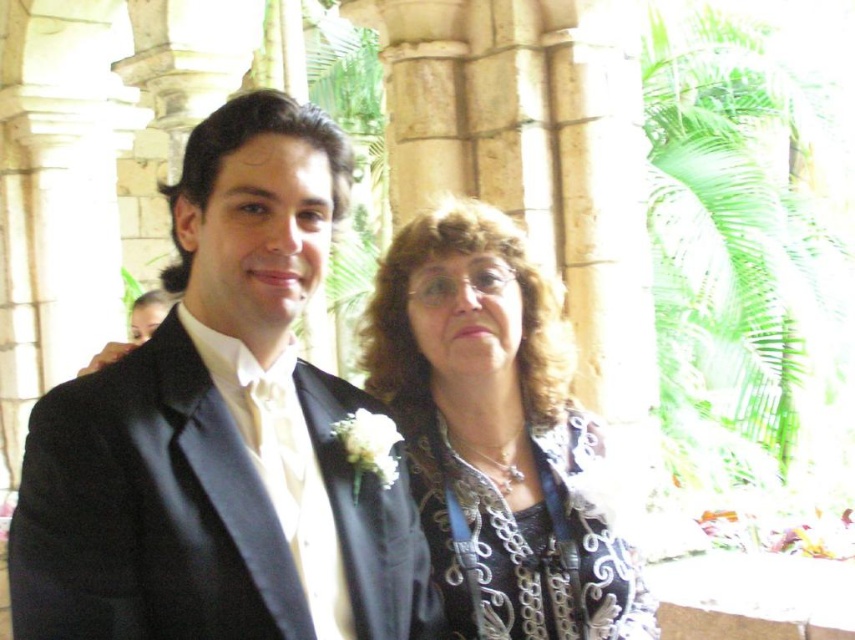
Question: Which object is the farthest from the satin black suit at center?

Choices:
 (A) silver embroidered jacket at center
 (B) silver metallic dress at center

Answer: (B)

Question: Which of the following is the closest to the observer?

Choices:
 (A) (516, 333)
 (B) (422, 476)

Answer: (B)

Question: Can you confirm if satin black suit at center is thinner than silver metallic dress at center?

Choices:
 (A) yes
 (B) no

Answer: (B)

Question: Which object is positioned closest to the silver metallic dress at center?

Choices:
 (A) satin black suit at center
 (B) silver embroidered jacket at center

Answer: (B)

Question: Is the position of silver embroidered jacket at center more distant than that of silver metallic dress at center?

Choices:
 (A) yes
 (B) no

Answer: (B)

Question: Can you confirm if silver embroidered jacket at center is smaller than silver metallic dress at center?

Choices:
 (A) yes
 (B) no

Answer: (B)